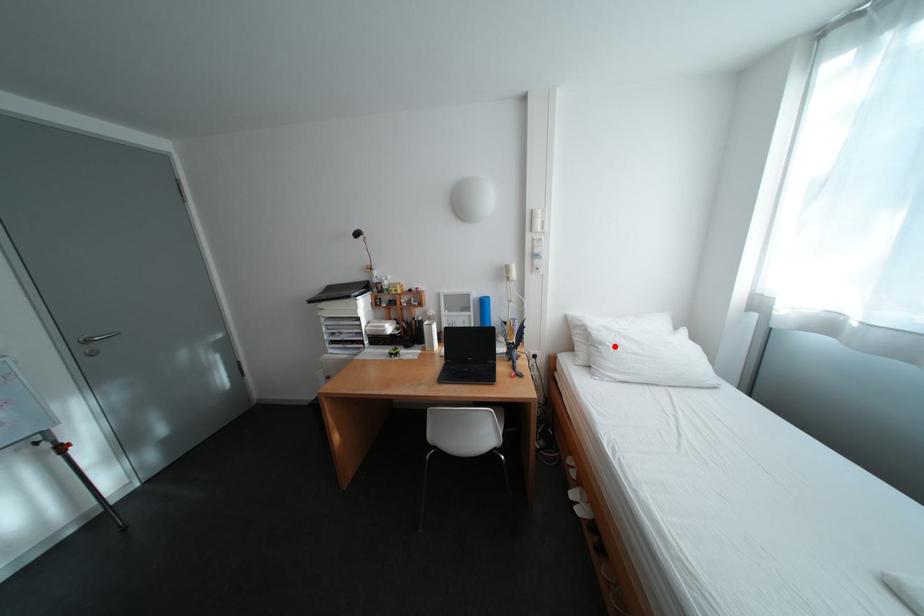
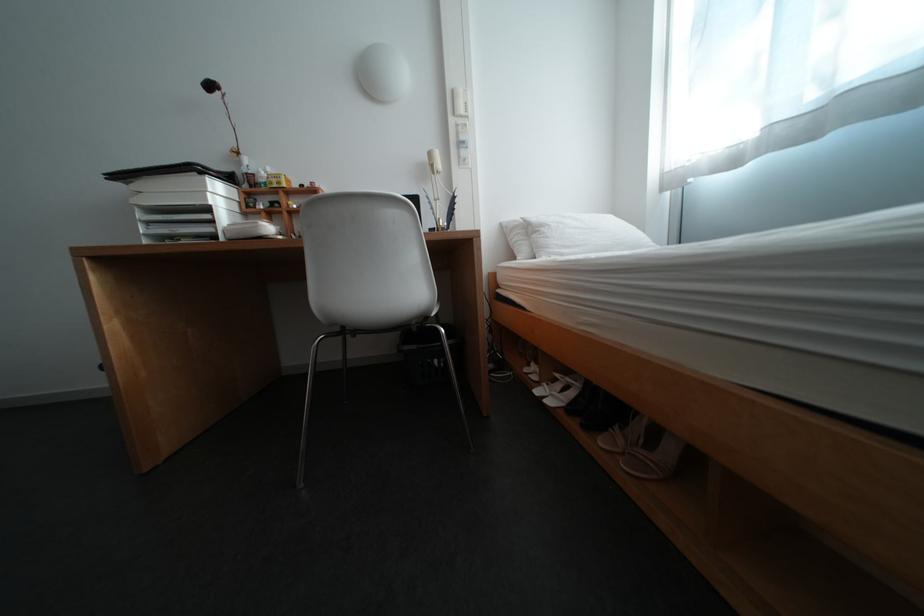
Find the pixel in the second image that matches the highlighted location in the first image.

(555, 228)